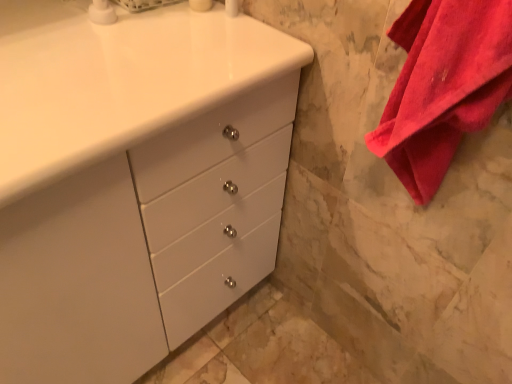
This screenshot has height=384, width=512. Identify the location of white glossy soap dispenser at upper left. (102, 12).

What do you see at coordinates (102, 12) in the screenshot? I see `white glossy soap dispenser at upper left` at bounding box center [102, 12].

Find the location of a particular element. white glossy soap dispenser at upper left is located at coordinates (102, 12).

How distant is red cotton towel at right from white glossy cabinet at center?

red cotton towel at right is 42.65 centimeters from white glossy cabinet at center.

Is white glossy cabinet at center located within red cotton towel at right?

That's incorrect, white glossy cabinet at center is not inside red cotton towel at right.

Who is shorter, red cotton towel at right or white glossy cabinet at center?

red cotton towel at right.

Considering the sizes of objects red cotton towel at right and white glossy cabinet at center in the image provided, who is bigger, red cotton towel at right or white glossy cabinet at center?

Bigger between the two is white glossy cabinet at center.

Which of these two, red cotton towel at right or white glossy soap dispenser at upper left, stands taller?

red cotton towel at right.

Locate an element on the screen. The width and height of the screenshot is (512, 384). bath towel located on the right of white glossy soap dispenser at upper left is located at coordinates (443, 86).

From the image's perspective, does red cotton towel at right appear lower than white glossy soap dispenser at upper left?

Indeed, from the image's perspective, red cotton towel at right is shown beneath white glossy soap dispenser at upper left.

Is point (460, 23) in front of point (99, 22)?

Yes, it is in front of point (99, 22).

Is white glossy soap dispenser at upper left not near red cotton towel at right?

Actually, white glossy soap dispenser at upper left and red cotton towel at right are a little close together.

The image size is (512, 384). Identify the location of soap dispenser that is above the red cotton towel at right (from a real-world perspective). (102, 12).

From the image's perspective, does white glossy soap dispenser at upper left appear lower than red cotton towel at right?

Incorrect, from the image's perspective, white glossy soap dispenser at upper left is higher than red cotton towel at right.

Considering the relative sizes of white glossy soap dispenser at upper left and red cotton towel at right in the image provided, is white glossy soap dispenser at upper left smaller than red cotton towel at right?

Yes.

Could you tell me if white glossy soap dispenser at upper left is turned towards white glossy cabinet at center?

No, white glossy soap dispenser at upper left is not oriented towards white glossy cabinet at center.

From a real-world perspective, is white glossy soap dispenser at upper left positioned above or below white glossy cabinet at center?

white glossy soap dispenser at upper left is above white glossy cabinet at center.

Considering the sizes of objects white glossy soap dispenser at upper left and white glossy cabinet at center in the image provided, who is taller, white glossy soap dispenser at upper left or white glossy cabinet at center?

With more height is white glossy cabinet at center.

From the picture: Which is more to the right, white glossy cabinet at center or red cotton towel at right?

Positioned to the right is red cotton towel at right.

Is red cotton towel at right surrounded by white glossy cabinet at center?

No, red cotton towel at right is located outside of white glossy cabinet at center.

Is white glossy cabinet at center oriented away from red cotton towel at right?

white glossy cabinet at center is not turned away from red cotton towel at right.

Which is in front, point (207, 146) or point (103, 21)?

The point (207, 146) is in front.

This screenshot has width=512, height=384. Identify the location of chest of drawers to the left of white glossy soap dispenser at upper left. (145, 244).

Is white glossy cabinet at center not close to white glossy soap dispenser at upper left?

No.

Can you confirm if white glossy cabinet at center is thinner than white glossy soap dispenser at upper left?

No, white glossy cabinet at center is not thinner than white glossy soap dispenser at upper left.

What are the coordinates of `the chest of drawers lying below the red cotton towel at right (from the image's perspective)` in the screenshot? It's located at (145, 244).

Locate an element on the screen. soap dispenser that appears above the red cotton towel at right (from the image's perspective) is located at coordinates (102, 12).

In the scene shown: Which object lies nearer to the anchor point white glossy soap dispenser at upper left, white glossy cabinet at center or red cotton towel at right?

white glossy cabinet at center is positioned closer to the anchor white glossy soap dispenser at upper left.

Based on their spatial positions, is red cotton towel at right or white glossy soap dispenser at upper left further from white glossy cabinet at center?

The object further to white glossy cabinet at center is white glossy soap dispenser at upper left.

Considering their positions, is white glossy soap dispenser at upper left positioned further to red cotton towel at right than white glossy cabinet at center?

The object further to red cotton towel at right is white glossy soap dispenser at upper left.

From the image, which object appears to be farther from red cotton towel at right, white glossy cabinet at center or white glossy soap dispenser at upper left?

white glossy soap dispenser at upper left is positioned further to the anchor red cotton towel at right.

Based on their spatial positions, is red cotton towel at right or white glossy cabinet at center closer to white glossy soap dispenser at upper left?

The object closer to white glossy soap dispenser at upper left is white glossy cabinet at center.

When comparing their distances from white glossy cabinet at center, does white glossy soap dispenser at upper left or red cotton towel at right seem further?

white glossy soap dispenser at upper left lies further to white glossy cabinet at center than the other object.

This screenshot has height=384, width=512. Identify the location of soap dispenser between white glossy cabinet at center and red cotton towel at right from left to right. (102, 12).